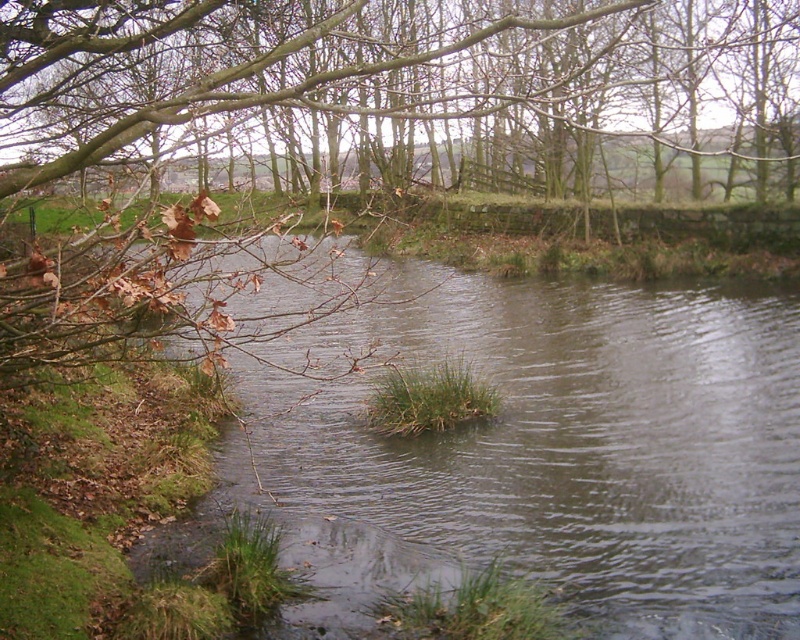
Consider the image. Does brown leafy branches at upper left have a lesser height compared to clear water at center?

No, brown leafy branches at upper left is not shorter than clear water at center.

Is point (601, 115) positioned after point (613, 472)?

Yes.

You are a GUI agent. You are given a task and a screenshot of the screen. Output one action in this format:
    pyautogui.click(x=<x>, y=<y>)
    Task: Click on the brown leafy branches at upper left
    
    Given the screenshot: What is the action you would take?
    pyautogui.click(x=358, y=132)